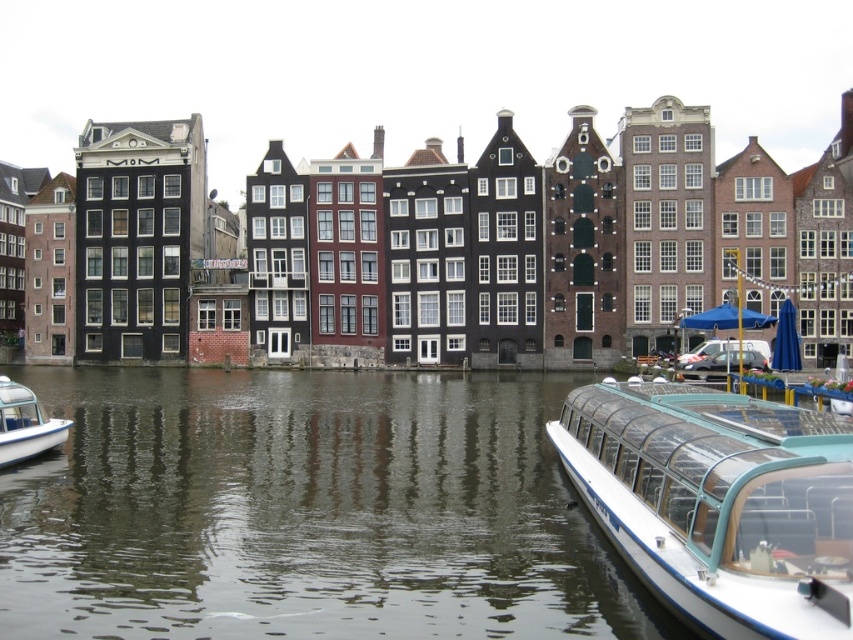
You are a tourist standing on the canal bridge and want to take a photo of the smooth water at center and the white glossy boat at lower right. Which one will appear closer to you in the photo?

The smooth water at center will appear closer to you in the photo because it is further to the viewer than the white glossy boat at lower right, meaning it is physically nearer to your position on the bridge.

In the scene shown: You are a tourist standing on the canal bridge and want to take a photo of the smooth water at center and the white glossy boat at lower right. Which object is wider from your perspective?

The smooth water at center might be wider than the white glossy boat at lower right.

You are a tourist standing on the canal bridge and want to take a photo of the smooth water at center and the white glossy boat at lower left. Which object will occupy more space in your photo?

The smooth water at center will occupy more space in the photo because it has a larger size compared to the white glossy boat at lower left.